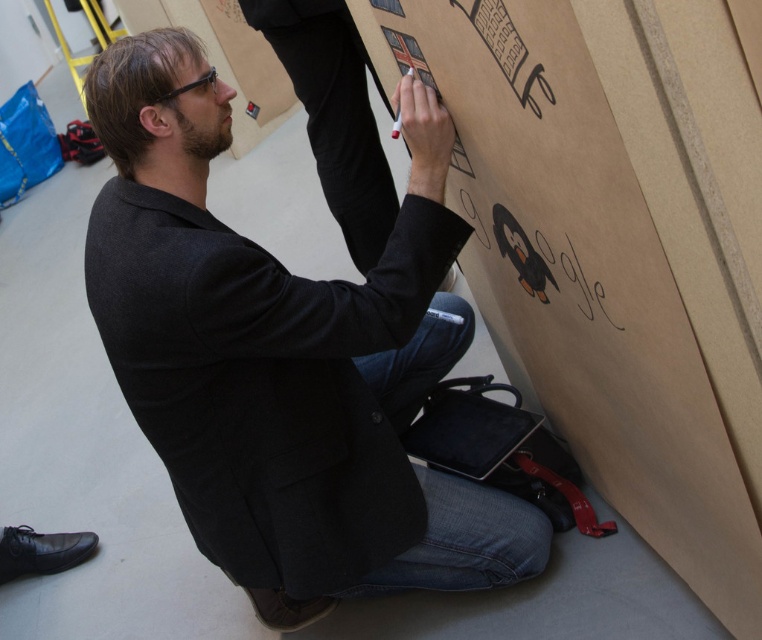
Question: Does brown cardboard at center have a lesser width compared to dark gray woolen blazer at center?

Choices:
 (A) yes
 (B) no

Answer: (A)

Question: Does brown cardboard at center have a smaller size compared to dark gray woolen blazer at center?

Choices:
 (A) yes
 (B) no

Answer: (B)

Question: Which of the following is the closest to the observer?

Choices:
 (A) (488, 307)
 (B) (373, 554)

Answer: (B)

Question: Which object appears farthest from the camera in this image?

Choices:
 (A) dark gray woolen blazer at center
 (B) brown cardboard at center

Answer: (A)

Question: Which of the following is the closest to the observer?

Choices:
 (A) (283, 288)
 (B) (754, 448)

Answer: (B)

Question: Is brown cardboard at center further to the viewer compared to dark gray woolen blazer at center?

Choices:
 (A) yes
 (B) no

Answer: (B)